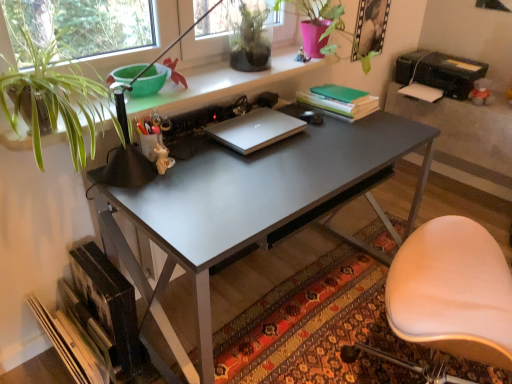
The image size is (512, 384). What are the coordinates of `free spot in front of matte white figurine at center` in the screenshot? It's located at (161, 195).